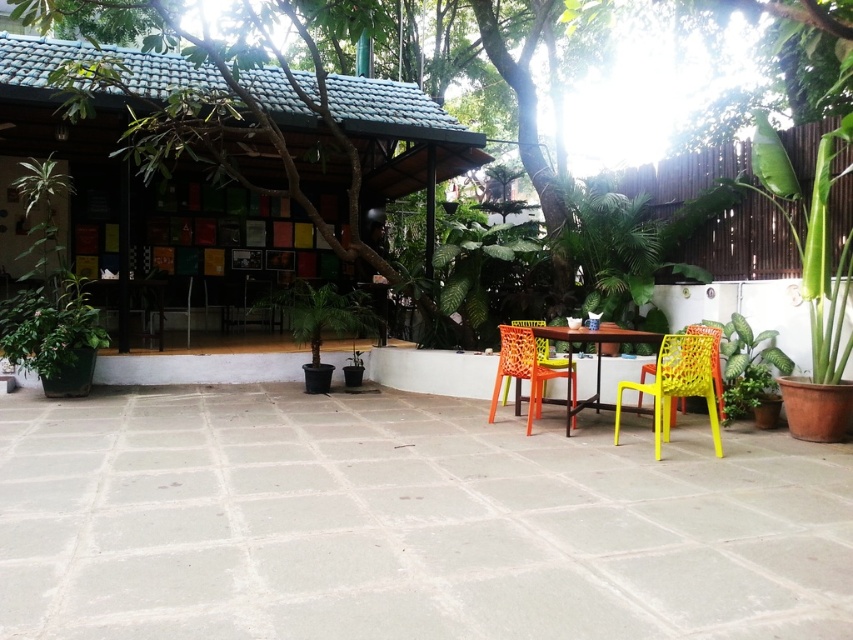
Does metallic yellow table at center appear on the right side of metallic silver chair at center?

Yes, metallic yellow table at center is to the right of metallic silver chair at center.

Who is shorter, metallic yellow table at center or metallic silver chair at center?

metallic silver chair at center is shorter.

Is point (543, 336) less distant than point (161, 282)?

Yes, point (543, 336) is in front of point (161, 282).

Locate an element on the screen. This screenshot has height=640, width=853. metallic yellow table at center is located at coordinates (595, 362).

Measure the distance from orange mesh chair at center to metallic yellow table at center.

7.45 inches

What do you see at coordinates (525, 369) in the screenshot? This screenshot has width=853, height=640. I see `orange mesh chair at center` at bounding box center [525, 369].

Between point (503, 365) and point (570, 384), which one is positioned behind?

Positioned behind is point (570, 384).

Locate an element on the screen. orange mesh chair at center is located at coordinates (525, 369).

Between point (26, 602) and point (158, 339), which one is positioned behind?

Positioned behind is point (158, 339).

Who is positioned more to the left, smooth concrete patio at center or metallic silver chair at center?

metallic silver chair at center is more to the left.

Which is behind, point (21, 467) or point (161, 310)?

The point (161, 310) is behind.

Find the location of a particular element. smooth concrete patio at center is located at coordinates (405, 522).